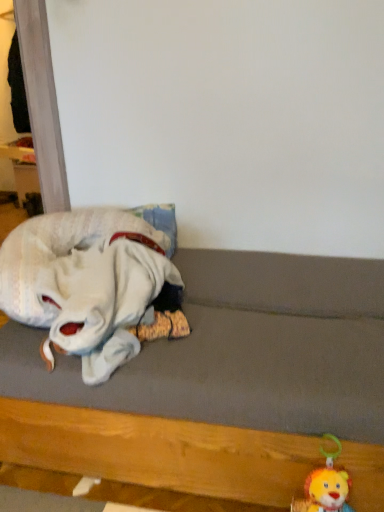
Question: Is white plush toy at left, the second toy viewed from the right, located outside wooden bed frame at lower left?

Choices:
 (A) no
 (B) yes

Answer: (A)

Question: Is white plush toy at left, the 1th toy in the left-to-right sequence, thinner than wooden bed frame at lower left?

Choices:
 (A) no
 (B) yes

Answer: (B)

Question: Is white plush toy at left, the 1th toy in the left-to-right sequence, to the right of wooden bed frame at lower left from the viewer's perspective?

Choices:
 (A) yes
 (B) no

Answer: (B)

Question: Is the depth of white plush toy at left, placed as the 1th toy when sorted from top to bottom, less than that of wooden bed frame at lower left?

Choices:
 (A) yes
 (B) no

Answer: (B)

Question: Does white plush toy at left, placed as the 1th toy when sorted from top to bottom, have a lesser height compared to wooden bed frame at lower left?

Choices:
 (A) no
 (B) yes

Answer: (B)

Question: Considering the positions of wooden bed frame at lower left and fluffy plush lion at lower right, which is the second toy from left to right, in the image, is wooden bed frame at lower left bigger or smaller than fluffy plush lion at lower right, which is the second toy from left to right,?

Choices:
 (A) small
 (B) big

Answer: (B)

Question: From the image's perspective, relative to fluffy plush lion at lower right, which is counted as the 2th toy, starting from the top, is wooden bed frame at lower left above or below?

Choices:
 (A) above
 (B) below

Answer: (A)

Question: Is wooden bed frame at lower left to the left or to the right of fluffy plush lion at lower right, which is the second toy from left to right, in the image?

Choices:
 (A) left
 (B) right

Answer: (A)

Question: In the image, is wooden bed frame at lower left positioned in front of or behind fluffy plush lion at lower right, the first toy from the right?

Choices:
 (A) behind
 (B) front

Answer: (B)

Question: From a real-world perspective, is white plush toy at left, the 1th toy in the left-to-right sequence, physically located above or below wooden bed frame at lower left?

Choices:
 (A) above
 (B) below

Answer: (A)

Question: From the image's perspective, is white plush toy at left, the second toy viewed from the right, above or below wooden bed frame at lower left?

Choices:
 (A) below
 (B) above

Answer: (B)

Question: Considering the relative positions of white plush toy at left, placed as the 1th toy when sorted from top to bottom, and wooden bed frame at lower left in the image provided, is white plush toy at left, placed as the 1th toy when sorted from top to bottom, to the left or to the right of wooden bed frame at lower left?

Choices:
 (A) right
 (B) left

Answer: (B)

Question: Is white plush toy at left, the 1th toy in the left-to-right sequence, spatially inside wooden bed frame at lower left, or outside of it?

Choices:
 (A) outside
 (B) inside

Answer: (B)

Question: Looking at the image, does wooden bed frame at lower left seem bigger or smaller compared to white plush toy at left, placed as the 1th toy when sorted from top to bottom?

Choices:
 (A) big
 (B) small

Answer: (A)

Question: From their relative heights in the image, would you say wooden bed frame at lower left is taller or shorter than white plush toy at left, placed as the 1th toy when sorted from top to bottom?

Choices:
 (A) short
 (B) tall

Answer: (B)